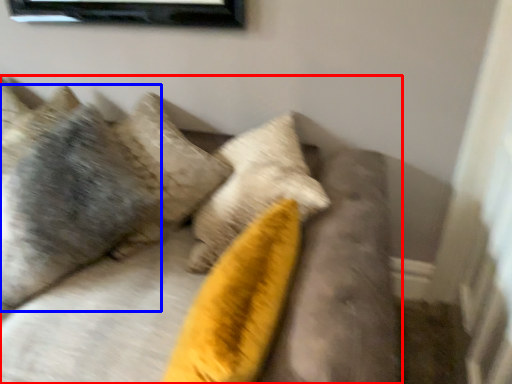
Question: Which point is further to the camera, furniture (highlighted by a red box) or pillow (highlighted by a blue box)?

Choices:
 (A) furniture
 (B) pillow

Answer: (B)